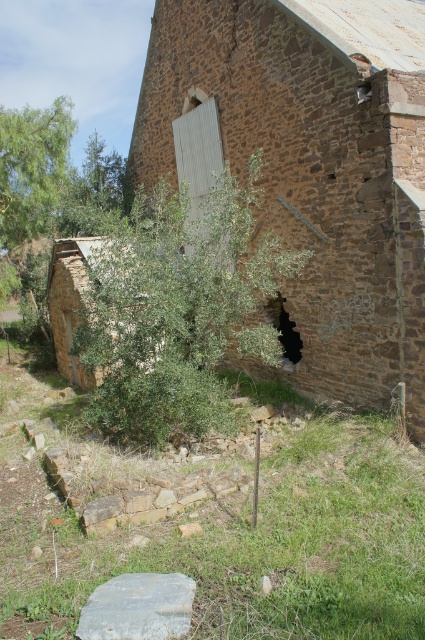
Question: Which point is farther to the camera?

Choices:
 (A) (64, 344)
 (B) (282, 323)
 (C) (221, 273)
 (D) (373, 280)

Answer: (A)

Question: Does brown stone wall at center appear under green leafy olive tree at center?

Choices:
 (A) no
 (B) yes

Answer: (A)

Question: Which point appears farthest from the camera in this image?

Choices:
 (A) (6, 120)
 (B) (300, 268)
 (C) (282, 212)

Answer: (A)

Question: Among these objects, which one is farthest from the camera?

Choices:
 (A) brown stone wall at center
 (B) green leafy olive tree at center
 (C) green leafy bush at center

Answer: (C)

Question: Is brown stone wall at center to the right of green leafy bush at center from the viewer's perspective?

Choices:
 (A) no
 (B) yes

Answer: (B)

Question: Does green leafy olive tree at center have a larger size compared to green leafy tree at upper left?

Choices:
 (A) no
 (B) yes

Answer: (A)